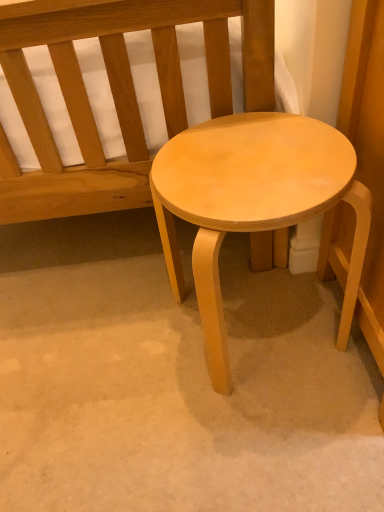
Where is `free point above light wood stool at center (from a real-world perspective)`? The image size is (384, 512). free point above light wood stool at center (from a real-world perspective) is located at coordinates (248, 160).